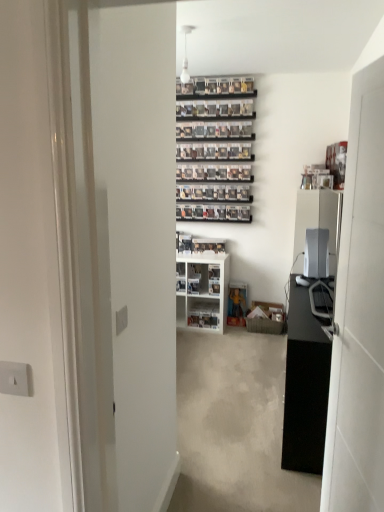
Question: Is white glossy cabinet at center smaller than white glossy shelf at center?

Choices:
 (A) yes
 (B) no

Answer: (B)

Question: Is white glossy cabinet at center directly adjacent to white glossy shelf at center?

Choices:
 (A) no
 (B) yes

Answer: (A)

Question: Is white glossy cabinet at center positioned behind white glossy shelf at center?

Choices:
 (A) no
 (B) yes

Answer: (A)

Question: Is white glossy cabinet at center at the right side of white glossy shelf at center?

Choices:
 (A) yes
 (B) no

Answer: (B)

Question: Is there a large distance between white glossy cabinet at center and white glossy shelf at center?

Choices:
 (A) no
 (B) yes

Answer: (A)

Question: From the image's perspective, is white glossy cabinet at center over white glossy shelf at center?

Choices:
 (A) yes
 (B) no

Answer: (A)

Question: Does white glossy shelf at center have a larger size compared to satin silver monitor at right?

Choices:
 (A) yes
 (B) no

Answer: (A)

Question: Is white glossy shelf at center in front of satin silver monitor at right?

Choices:
 (A) yes
 (B) no

Answer: (B)

Question: Is satin silver monitor at right at the back of white glossy shelf at center?

Choices:
 (A) no
 (B) yes

Answer: (A)

Question: From the image's perspective, is white glossy shelf at center located beneath satin silver monitor at right?

Choices:
 (A) no
 (B) yes

Answer: (B)

Question: Is white glossy shelf at center positioned beyond the bounds of satin silver monitor at right?

Choices:
 (A) no
 (B) yes

Answer: (B)

Question: Considering the relative sizes of white glossy shelf at center and satin silver monitor at right in the image provided, is white glossy shelf at center wider than satin silver monitor at right?

Choices:
 (A) no
 (B) yes

Answer: (B)

Question: Does white glossy cabinet at center come in front of white glossy door at right?

Choices:
 (A) no
 (B) yes

Answer: (A)